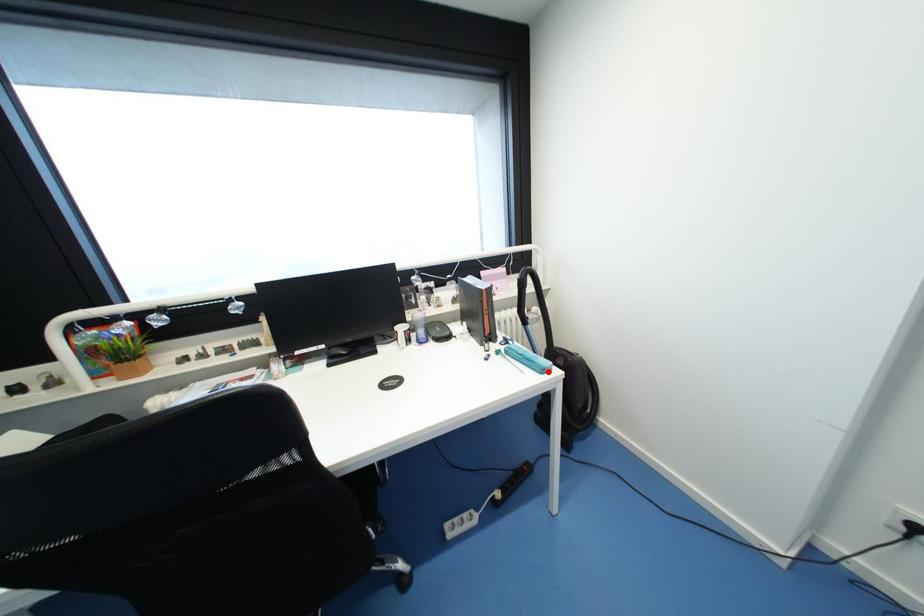
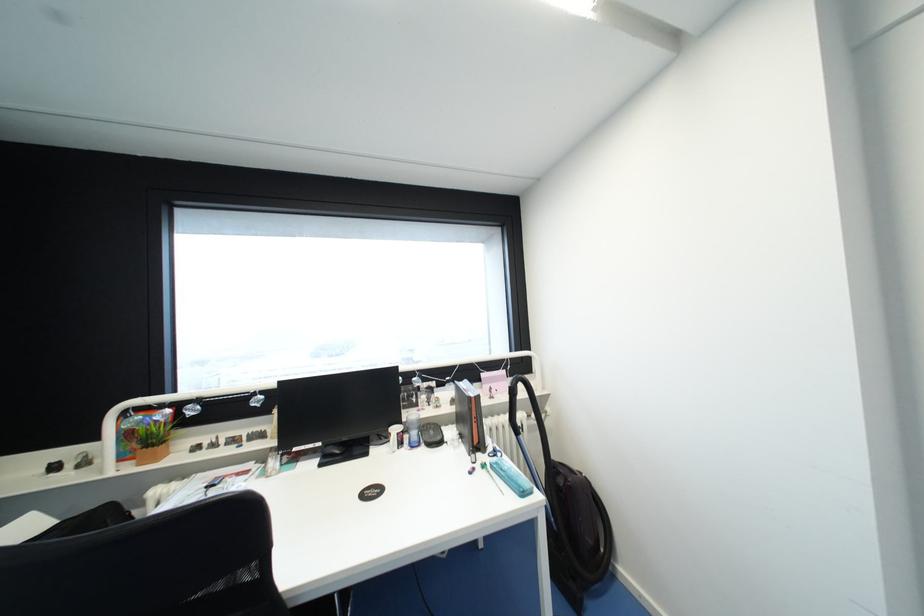
Find the pixel in the second image that matches the highlighted location in the first image.

(528, 495)